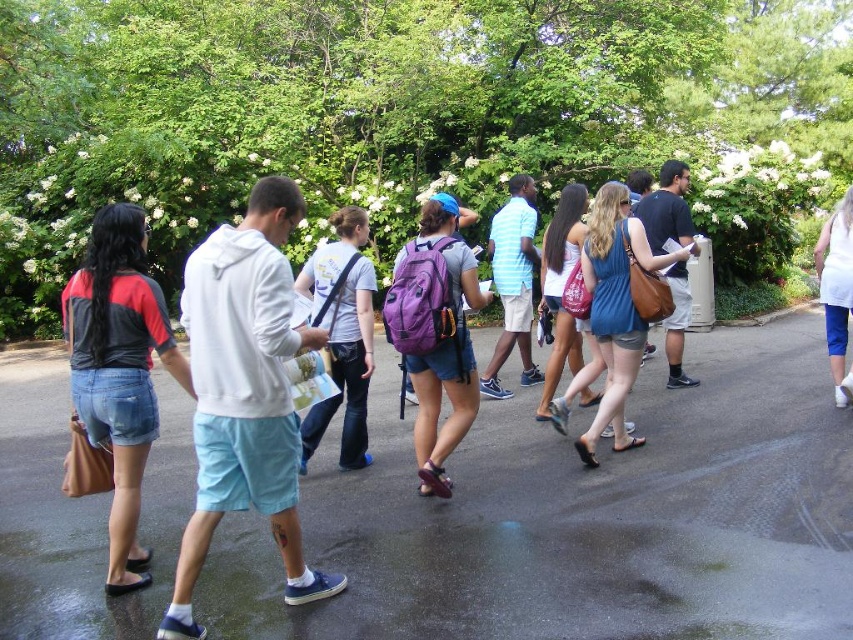
Who is positioned more to the left, white matte hoodie at center or denim shorts at left?

denim shorts at left is more to the left.

Find the location of a particular element. The width and height of the screenshot is (853, 640). white matte hoodie at center is located at coordinates click(244, 394).

Which is below, glossy asphalt pavement at center or purple matte backpack at center?

glossy asphalt pavement at center is lower down.

Who is positioned more to the right, glossy asphalt pavement at center or purple matte backpack at center?

From the viewer's perspective, purple matte backpack at center appears more on the right side.

Does point (230, 637) lie in front of point (426, 244)?

Yes, point (230, 637) is in front of point (426, 244).

Locate an element on the screen. glossy asphalt pavement at center is located at coordinates (582, 518).

Can you confirm if denim shorts at left is positioned to the right of purple matte backpack at center?

In fact, denim shorts at left is to the left of purple matte backpack at center.

Locate an element on the screen. denim shorts at left is located at coordinates (119, 369).